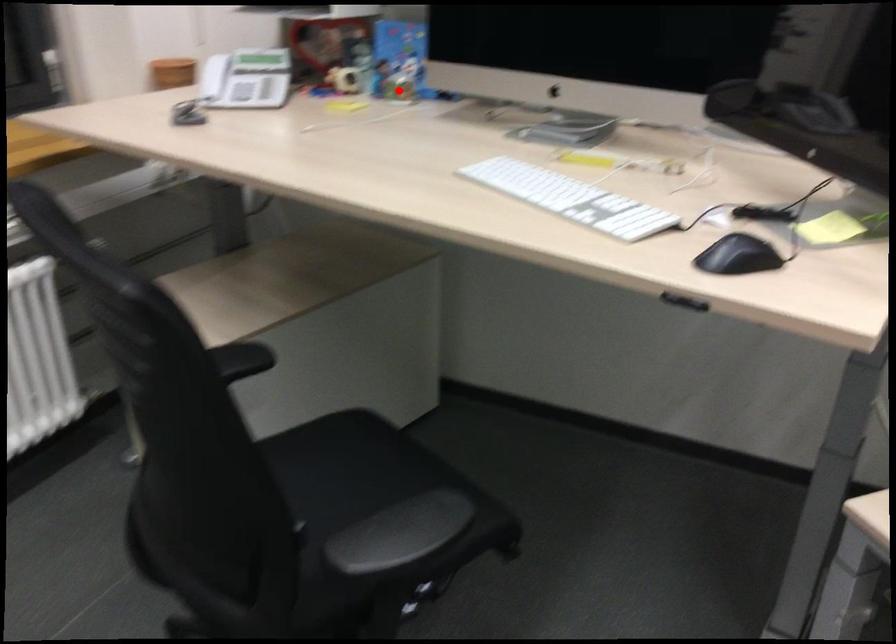
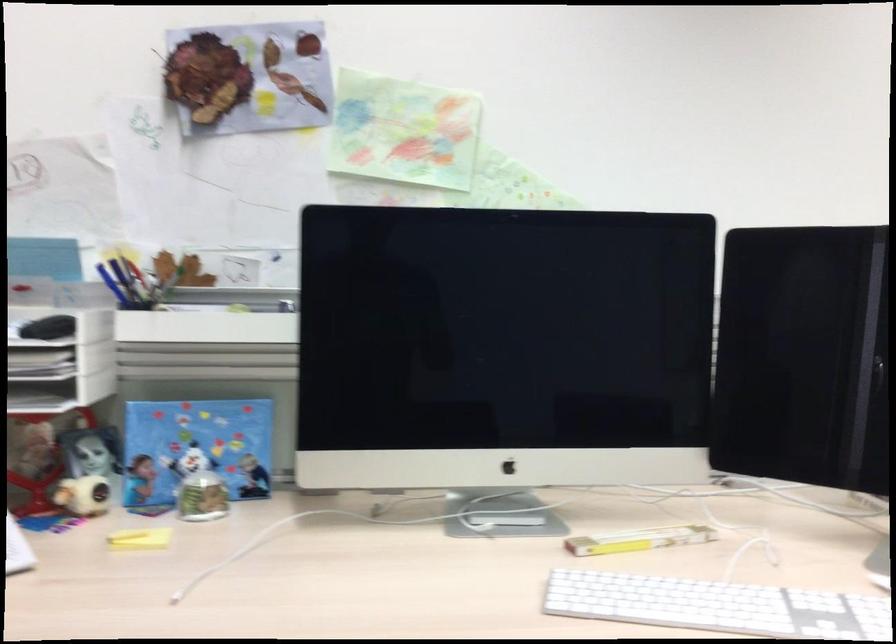
Question: A red point is marked in image1. In image2, is the corresponding 3D point closer to the camera or farther? Reply with the corresponding letter.

Choices:
 (A) The corresponding 3D point is closer.
 (B) The corresponding 3D point is farther.

Answer: (A)